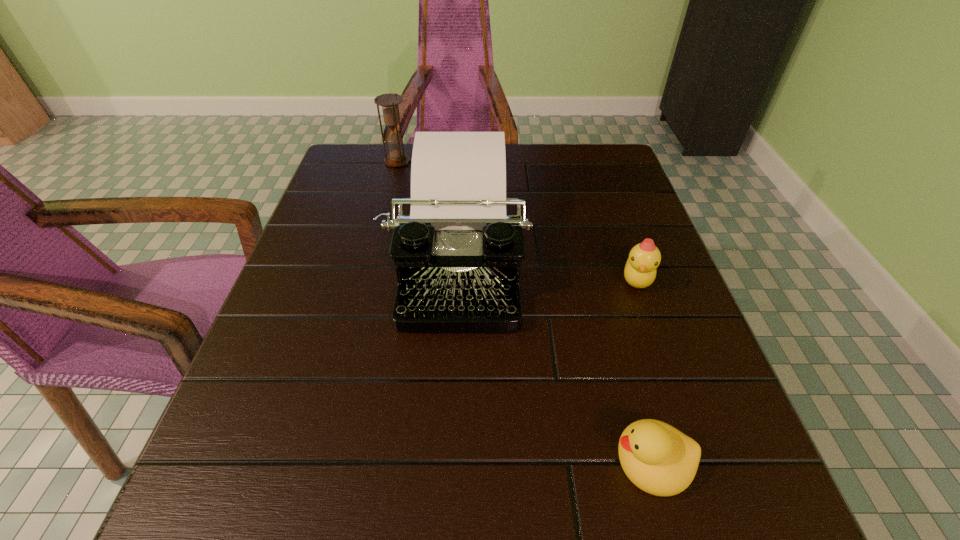
Where is `free space located 0.350m on the face of the shorter duckling`? free space located 0.350m on the face of the shorter duckling is located at coordinates (365, 461).

You are a GUI agent. You are given a task and a screenshot of the screen. Output one action in this format:
    pyautogui.click(x=<x>, y=<y>)
    Task: Click on the vacant region located on the face of the shorter duckling
    This screenshot has height=540, width=960.
    Given the screenshot: What is the action you would take?
    pyautogui.click(x=527, y=461)

Where is `object at the far edge`? The image size is (960, 540). object at the far edge is located at coordinates (389, 102).

I want to click on object that is at the near edge, so click(x=659, y=459).

You are a GUI agent. You are given a task and a screenshot of the screen. Output one action in this format:
    pyautogui.click(x=<x>, y=<y>)
    Task: Click on the object positioned at the left edge
    
    Given the screenshot: What is the action you would take?
    pyautogui.click(x=389, y=102)

This screenshot has width=960, height=540. Find the location of `object located in the far left corner section of the desktop`. object located in the far left corner section of the desktop is located at coordinates (389, 102).

Image resolution: width=960 pixels, height=540 pixels. What are the coordinates of `object located at the near right corner` in the screenshot? It's located at (659, 459).

What are the coordinates of `vacant space at the far edge of the desktop` in the screenshot? It's located at (548, 183).

In the image, there is a desktop. Where is `vacant space at the near edge`? This screenshot has height=540, width=960. vacant space at the near edge is located at coordinates (382, 489).

The image size is (960, 540). In the image, there is a desktop. Identify the location of vacant space at the left edge. coord(329,225).